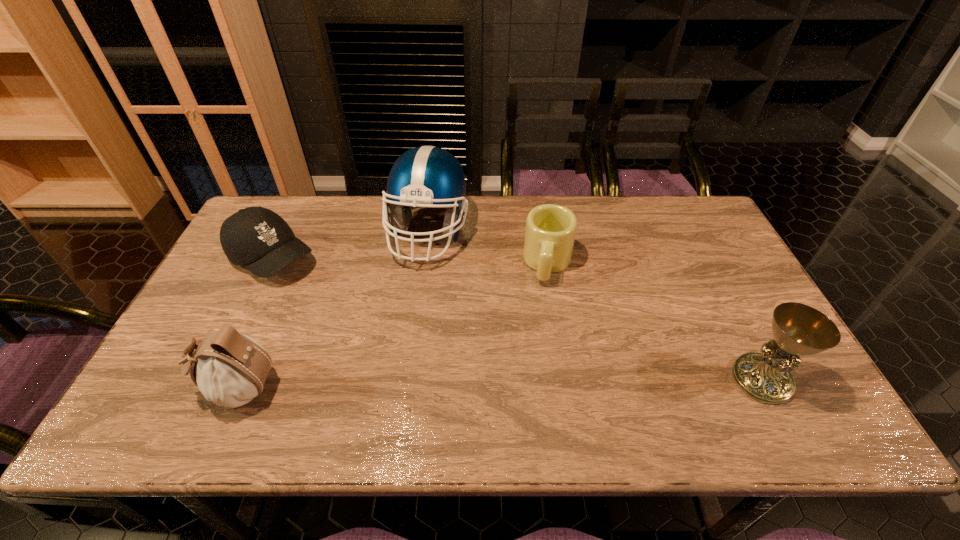
At what (x,y) coordinates should I click in order to perform the action: click on free spot on the desktop that is between the pouch and the chalice and is positioned with the handle on the side of the fourth object from left to right. Please return your answer as a coordinate pair (x, y). Image resolution: width=960 pixels, height=540 pixels. Looking at the image, I should click on (528, 383).

What are the coordinates of `free space on the desktop that is between the pouch and the rightmost object and is positioned on the front-facing side of the baseball cap` in the screenshot? It's located at (453, 384).

You are a GUI agent. You are given a task and a screenshot of the screen. Output one action in this format:
    pyautogui.click(x=<x>, y=<y>)
    Task: Click on the vacant space on the desktop that is between the pouch and the chalice and is positioned at the front of the third object from right to left with the faceguard
    The image size is (960, 540).
    Given the screenshot: What is the action you would take?
    pyautogui.click(x=553, y=383)